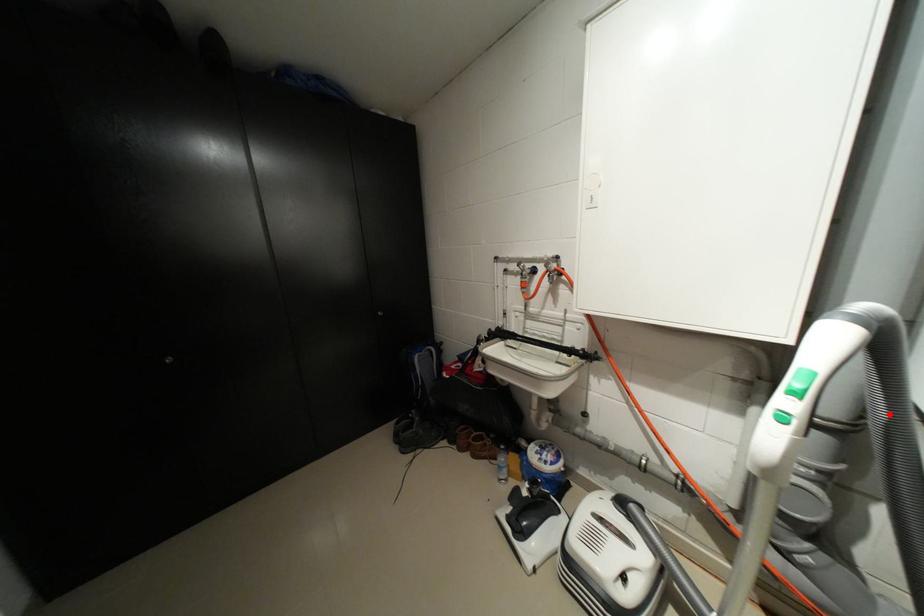
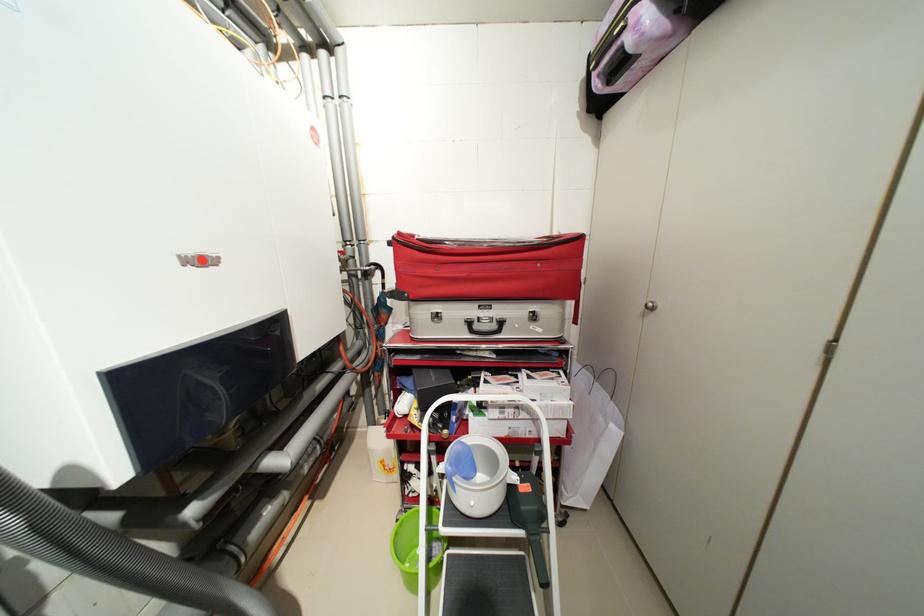
Find the pixel in the second image that matches the highlighted location in the first image.

(19, 523)